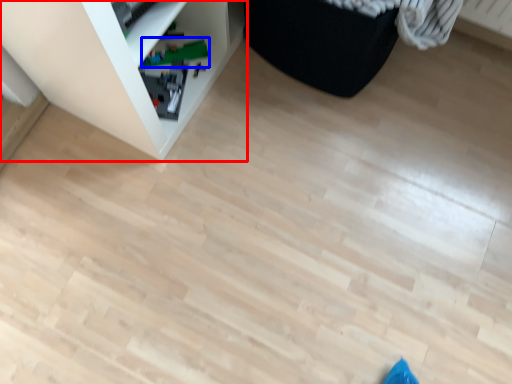
Question: Which point is further to the camera, shelf (highlighted by a red box) or toy (highlighted by a blue box)?

Choices:
 (A) shelf
 (B) toy

Answer: (B)